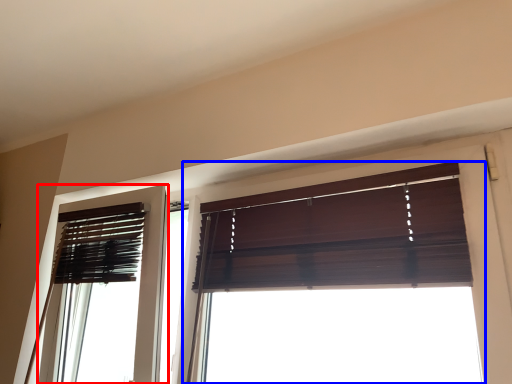
Question: Which object is further to the camera taking this photo, screen door (highlighted by a red box) or window (highlighted by a blue box)?

Choices:
 (A) screen door
 (B) window

Answer: (A)